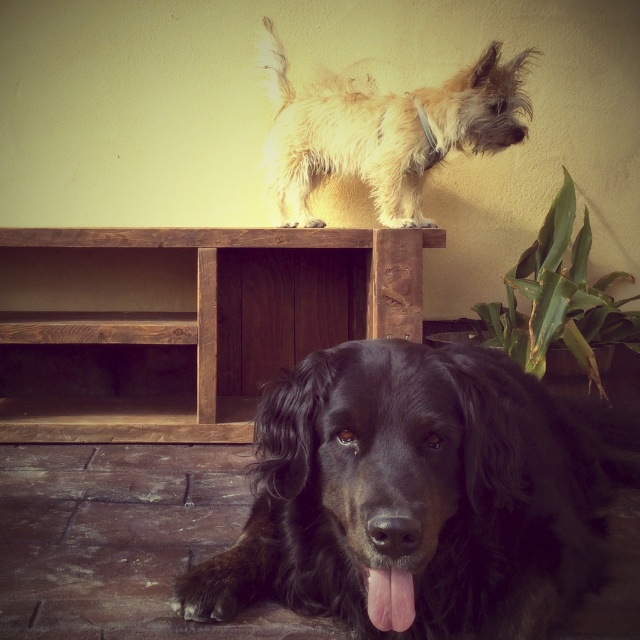
Question: Which point is closer to the camera taking this photo?

Choices:
 (A) (588, 528)
 (B) (374, 170)

Answer: (A)

Question: Where is black fur dog at lower center located in relation to fuzzy beige dog at upper center in the image?

Choices:
 (A) right
 (B) left

Answer: (A)

Question: Is black fur dog at lower center smaller than fuzzy beige dog at upper center?

Choices:
 (A) no
 (B) yes

Answer: (A)

Question: Which object appears farthest from the camera in this image?

Choices:
 (A) black fur dog at lower center
 (B) fuzzy beige dog at upper center

Answer: (B)

Question: Does black fur dog at lower center have a lesser width compared to fuzzy beige dog at upper center?

Choices:
 (A) no
 (B) yes

Answer: (A)